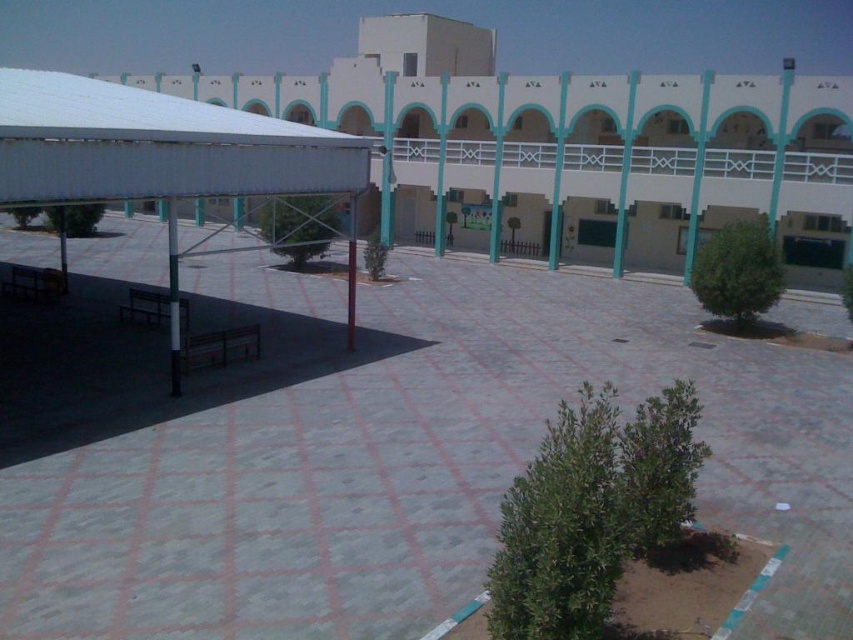
Between gray concrete courtyard at center and white matte canopy at upper left, which one has less height?

gray concrete courtyard at center

Can you confirm if gray concrete courtyard at center is wider than white matte canopy at upper left?

Correct, the width of gray concrete courtyard at center exceeds that of white matte canopy at upper left.

Is point (840, 531) positioned in front of point (135, 164)?

Yes.

Identify the location of gray concrete courtyard at center. This screenshot has width=853, height=640. (413, 461).